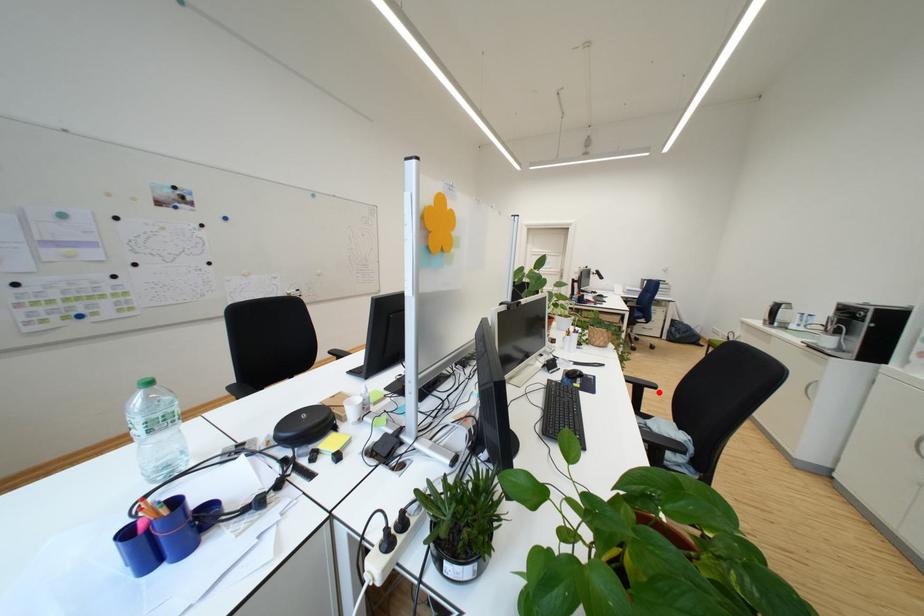
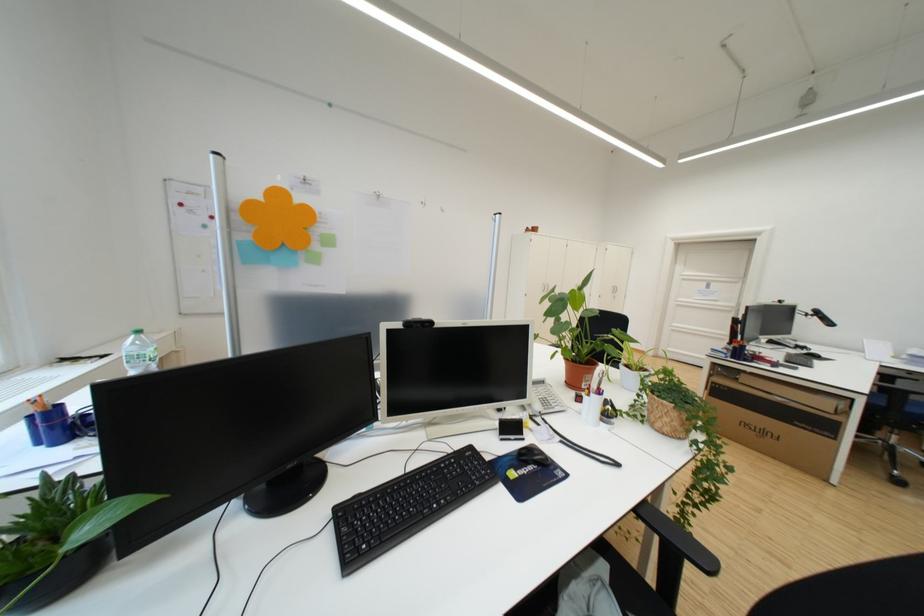
Where in the second image is the point corresponding to the highlighted location from the first image?

(700, 567)